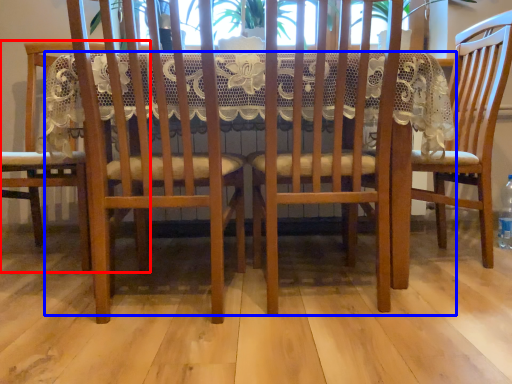
Question: Which object appears closest to the camera in this image, chair (highlighted by a red box) or table (highlighted by a blue box)?

Choices:
 (A) chair
 (B) table

Answer: (B)